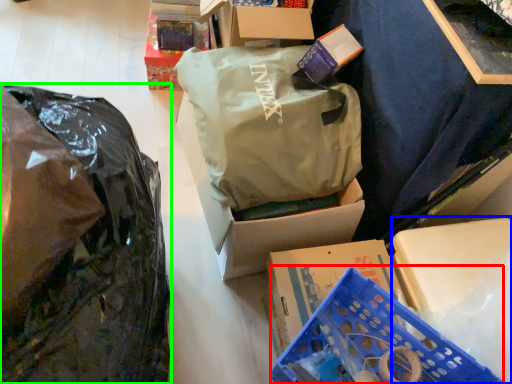
Question: Estimate the real-world distances between objects in this image. Which object is closer to basket (highlighted by a red box), storage box (highlighted by a blue box) or plastic bag (highlighted by a green box)?

Choices:
 (A) storage box
 (B) plastic bag

Answer: (A)